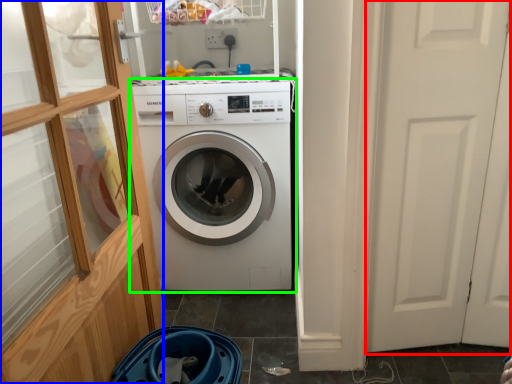
Question: Which is farther away from screen door (highlighted by a red box)? glass door (highlighted by a blue box) or washing machine (highlighted by a green box)?

Choices:
 (A) glass door
 (B) washing machine

Answer: (A)